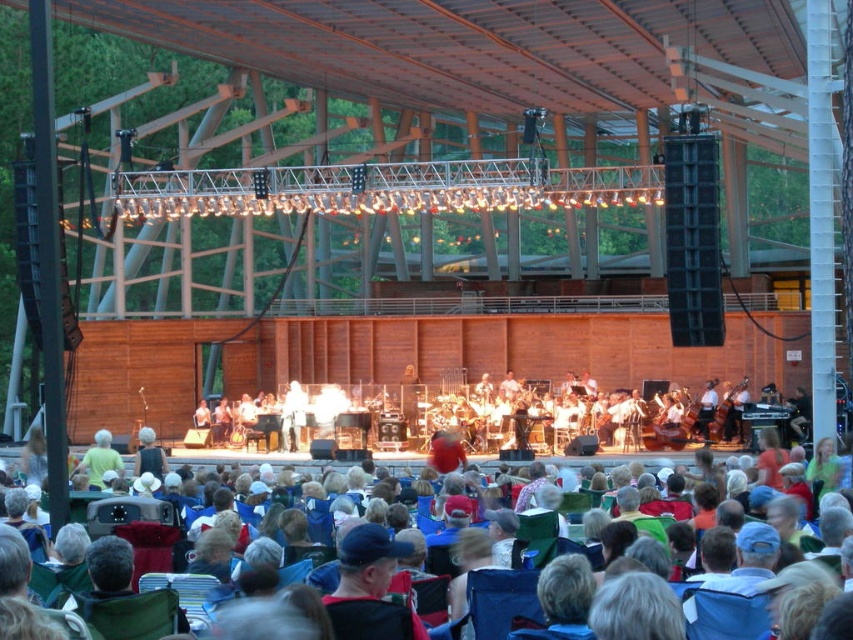
Between blue fabric chairs at center and light green fabric at center, which one appears on the left side from the viewer's perspective?

Positioned to the left is light green fabric at center.

Can you confirm if blue fabric chairs at center is wider than light green fabric at center?

Yes, blue fabric chairs at center is wider than light green fabric at center.

At what (x,y) coordinates should I click in order to perform the action: click on blue fabric chairs at center. Please return your answer as a coordinate pair (x, y). This screenshot has width=853, height=640. Looking at the image, I should click on (724, 614).